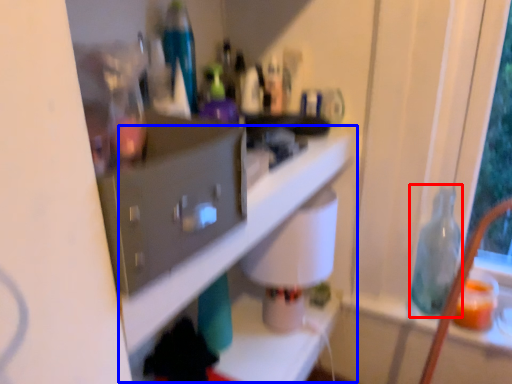
Question: Which object is further to the camera taking this photo, bottle (highlighted by a red box) or shelf (highlighted by a blue box)?

Choices:
 (A) bottle
 (B) shelf

Answer: (A)